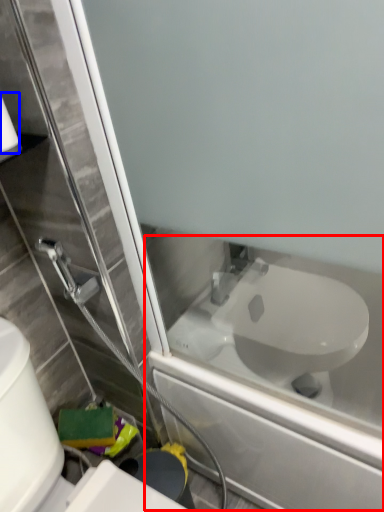
Question: Which object is further to the camera taking this photo, bath (highlighted by a red box) or toilet paper (highlighted by a blue box)?

Choices:
 (A) bath
 (B) toilet paper

Answer: (A)